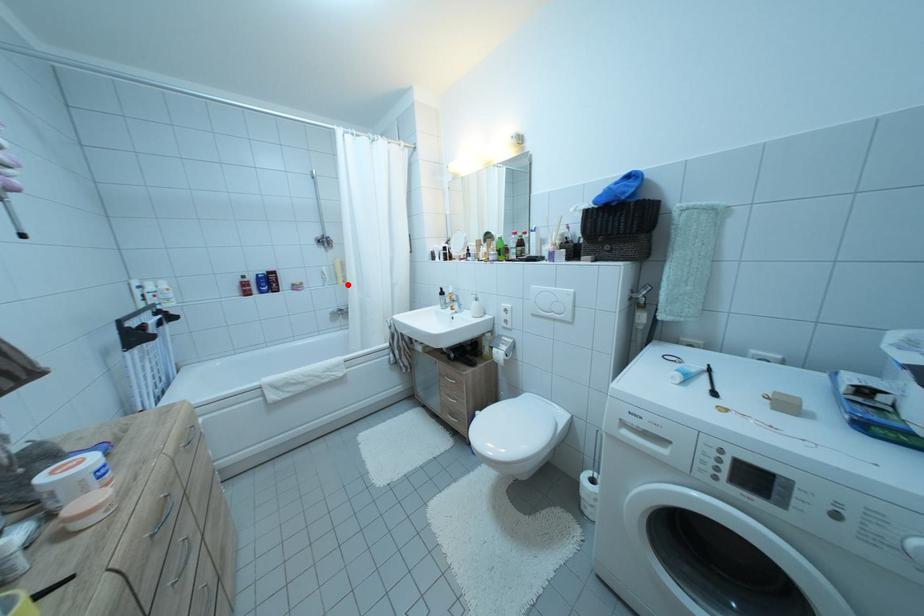
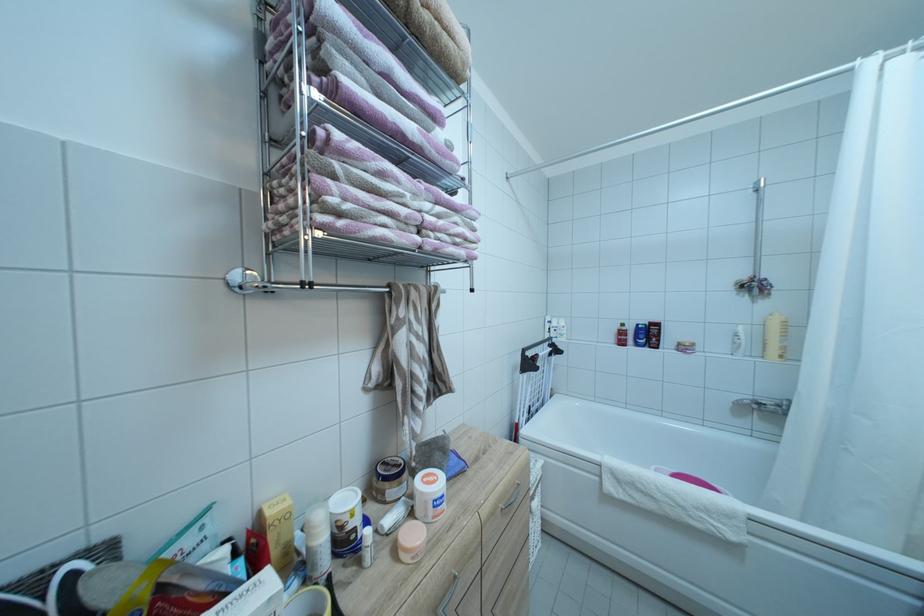
In the second image, find the point that corresponds to the highlighted location in the first image.

(781, 357)